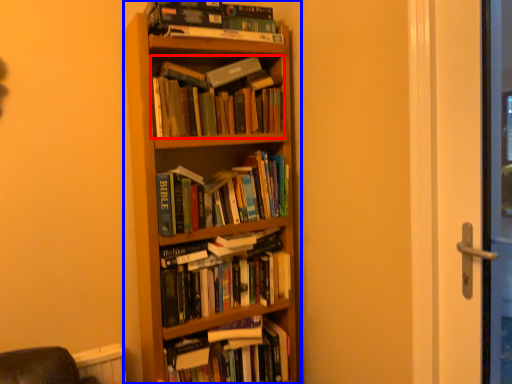
Question: Which of the following is the farthest to the observer, book (highlighted by a red box) or bookcase (highlighted by a blue box)?

Choices:
 (A) book
 (B) bookcase

Answer: (A)